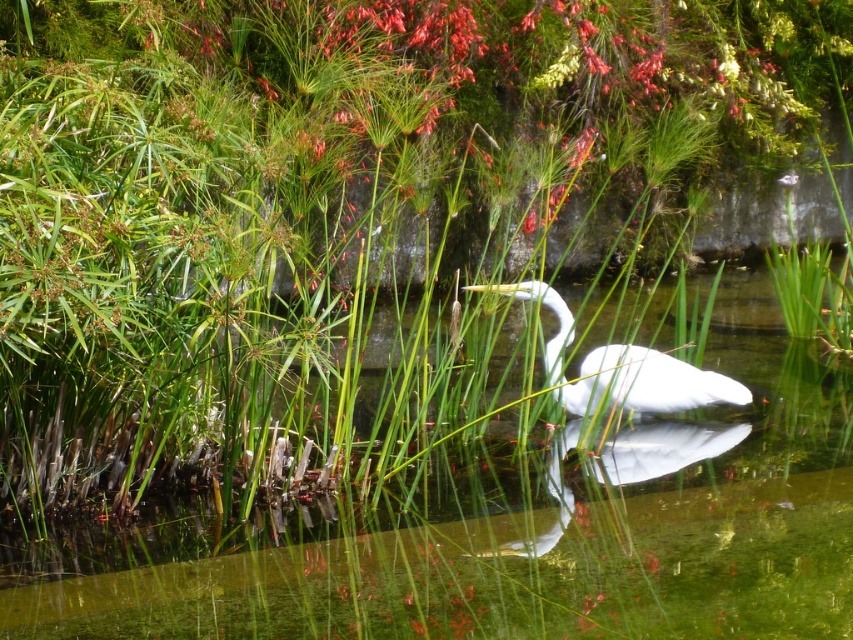
Between point (450, 605) and point (738, 387), which one is positioned behind?

The point (738, 387) is behind.

Which of these two, clear water at center or white feathered bird at center, stands shorter?

Standing shorter between the two is clear water at center.

Where is `clear water at center`? The image size is (853, 640). clear water at center is located at coordinates (503, 536).

Locate an element on the screen. This screenshot has width=853, height=640. clear water at center is located at coordinates click(x=503, y=536).